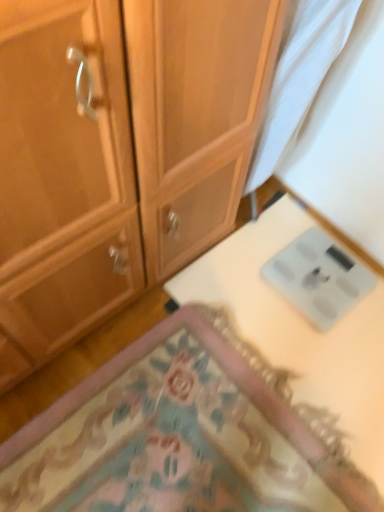
Describe the element at coordinates (299, 78) in the screenshot. The height and width of the screenshot is (512, 384). I see `white sheer curtain at upper right` at that location.

Identify the location of carpeted mat at lower center. This screenshot has width=384, height=512. (183, 435).

Considering the sizes of white sheer curtain at upper right and white glossy scale at lower right in the image, is white sheer curtain at upper right bigger or smaller than white glossy scale at lower right?

In the image, white sheer curtain at upper right appears to be larger than white glossy scale at lower right.

Are white sheer curtain at upper right and white glossy scale at lower right far apart?

No, white sheer curtain at upper right is not far from white glossy scale at lower right.

Is white sheer curtain at upper right turned away from white glossy scale at lower right?

No, white sheer curtain at upper right is not facing away from white glossy scale at lower right.

Can you confirm if white sheer curtain at upper right is shorter than white glossy scale at lower right?

In fact, white sheer curtain at upper right may be taller than white glossy scale at lower right.

Based on the photo, is carpeted mat at lower center not within white glossy scale at lower right?

Yes, carpeted mat at lower center is located beyond the bounds of white glossy scale at lower right.

In the scene shown: From the image's perspective, is carpeted mat at lower center over white glossy scale at lower right?

No, from the image's perspective, carpeted mat at lower center is not over white glossy scale at lower right.

Looking at the image, does carpeted mat at lower center seem bigger or smaller compared to white glossy scale at lower right?

Considering their sizes, carpeted mat at lower center takes up more space than white glossy scale at lower right.

Which is behind, white glossy scale at lower right or carpeted mat at lower center?

white glossy scale at lower right.

Visually, is white glossy scale at lower right positioned to the left or to the right of carpeted mat at lower center?

white glossy scale at lower right is positioned on carpeted mat at lower center's right side.

From the image's perspective, which is below, white glossy scale at lower right or carpeted mat at lower center?

carpeted mat at lower center.

Locate an element on the screen. This screenshot has width=384, height=512. mat to the left of white sheer curtain at upper right is located at coordinates (183, 435).

Are carpeted mat at lower center and white sheer curtain at upper right located far from each other?

No, carpeted mat at lower center is not far from white sheer curtain at upper right.

Could white sheer curtain at upper right be considered to be inside carpeted mat at lower center?

Definitely not — white sheer curtain at upper right is not inside carpeted mat at lower center.

Is white glossy scale at lower right behind white sheer curtain at upper right?

Yes, white glossy scale at lower right is further from the camera.

Is white glossy scale at lower right bigger or smaller than white sheer curtain at upper right?

In the image, white glossy scale at lower right appears to be smaller than white sheer curtain at upper right.

From the image's perspective, which one is positioned lower, white glossy scale at lower right or white sheer curtain at upper right?

white glossy scale at lower right is shown below in the image.

Which object is further away from the camera taking this photo, white sheer curtain at upper right or carpeted mat at lower center?

carpeted mat at lower center.

Is point (289, 138) in front of point (88, 437)?

No, (289, 138) is behind (88, 437).

The image size is (384, 512). I want to click on mat below the white sheer curtain at upper right (from the image's perspective), so click(x=183, y=435).

Which of these two, white sheer curtain at upper right or carpeted mat at lower center, is smaller?

With smaller size is white sheer curtain at upper right.

Find the location of a particular element. fabric that is above the white glossy scale at lower right (from a real-world perspective) is located at coordinates (299, 78).

Where is `table behind the carpeted mat at lower center`? table behind the carpeted mat at lower center is located at coordinates (300, 329).

When comparing their distances from white sheer curtain at upper right, does carpeted mat at lower center or white glossy scale at lower right seem further?

carpeted mat at lower center is positioned further to the anchor white sheer curtain at upper right.

Looking at this image, based on their spatial positions, is white sheer curtain at upper right or white glossy scale at lower right closer to carpeted mat at lower center?

white glossy scale at lower right is positioned closer to the anchor carpeted mat at lower center.

Considering their positions, is white glossy scale at lower right positioned closer to carpeted mat at lower center than white sheer curtain at upper right?

Among the two, white glossy scale at lower right is located nearer to carpeted mat at lower center.

Consider the image. Considering their positions, is white sheer curtain at upper right positioned further to white glossy scale at lower right than carpeted mat at lower center?

white sheer curtain at upper right is positioned further to the anchor white glossy scale at lower right.

Looking at the image, which one is located closer to white sheer curtain at upper right, white glossy scale at lower right or carpeted mat at lower center?

white glossy scale at lower right is closer to white sheer curtain at upper right.

Based on their spatial positions, is carpeted mat at lower center or white sheer curtain at upper right further from white glossy scale at lower right?

The object further to white glossy scale at lower right is white sheer curtain at upper right.

Identify the location of table that lies between white sheer curtain at upper right and carpeted mat at lower center from top to bottom. (300, 329).